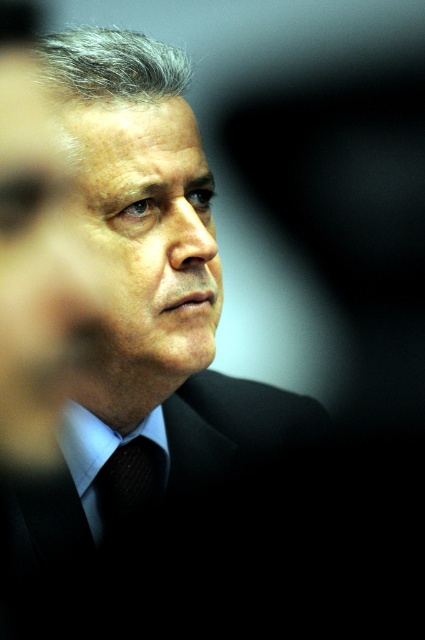
Who is higher up, black silk suit at center or light blue fabric dress shirt at center?

black silk suit at center

Is black silk suit at center smaller than light blue fabric dress shirt at center?

Actually, black silk suit at center might be larger than light blue fabric dress shirt at center.

Identify the location of black silk suit at center. (155, 520).

Does black textured tie at center appear under light blue fabric dress shirt at center?

Correct, black textured tie at center is located below light blue fabric dress shirt at center.

Consider the image. Can you confirm if black textured tie at center is bigger than light blue fabric dress shirt at center?

Actually, black textured tie at center might be smaller than light blue fabric dress shirt at center.

Who is more forward, (155, 474) or (93, 468)?

Point (93, 468)

Where is `black textured tie at center`? The image size is (425, 640). black textured tie at center is located at coordinates [129, 483].

Which of these two, black silk suit at center or black textured tie at center, stands shorter?

black textured tie at center

Between black silk suit at center and black textured tie at center, which one appears on the left side from the viewer's perspective?

Positioned to the left is black textured tie at center.

What are the coordinates of `black silk suit at center` in the screenshot? It's located at (155, 520).